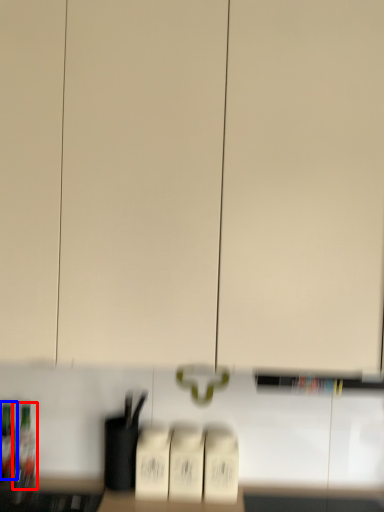
Question: Which point is further to the camera, bottle (highlighted by a red box) or bottle (highlighted by a blue box)?

Choices:
 (A) bottle
 (B) bottle

Answer: (B)